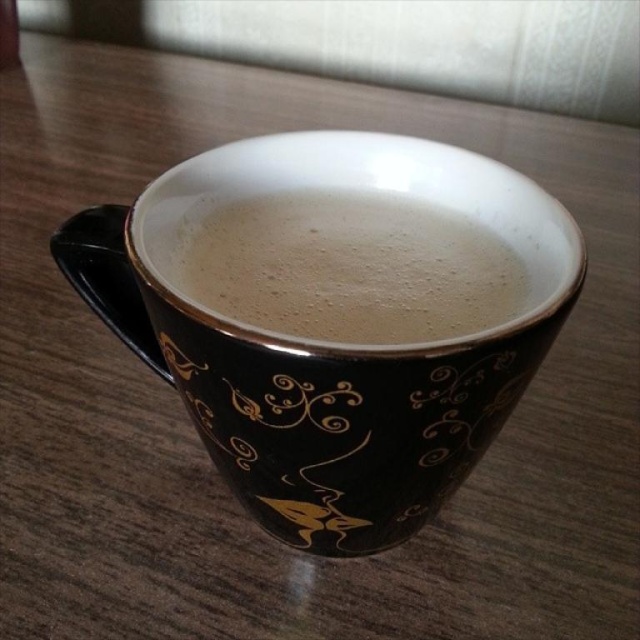
Does black ceramic mug at center come in front of white frothy coffee at center?

That is True.

Between black ceramic mug at center and white frothy coffee at center, which one is positioned lower?

Positioned lower is black ceramic mug at center.

Between point (198, 400) and point (376, 248), which one is positioned behind?

The point (376, 248) is more distant.

The width and height of the screenshot is (640, 640). Identify the location of black ceramic mug at center. (326, 342).